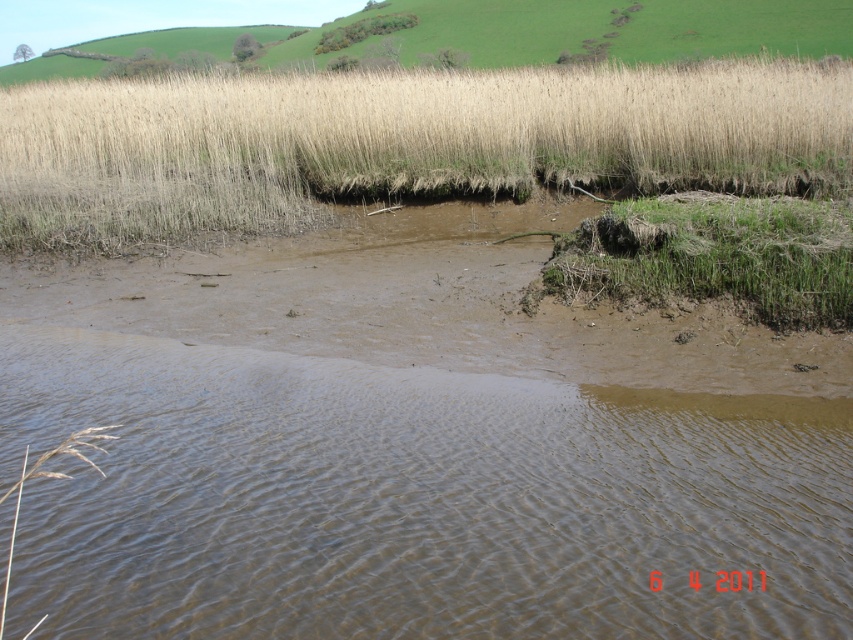
You are a hiker who wants to cross from the dry grass at upper center to the green grassy patch at lower right. Given that your maximum comfortable walking distance is 10 meters, can you safely make this journey without needing to rest?

The dry grass at upper center and green grassy patch at lower right are 8.90 meters apart from each other. Since your maximum comfortable walking distance is 10 meters, you can safely make the journey without needing to rest.